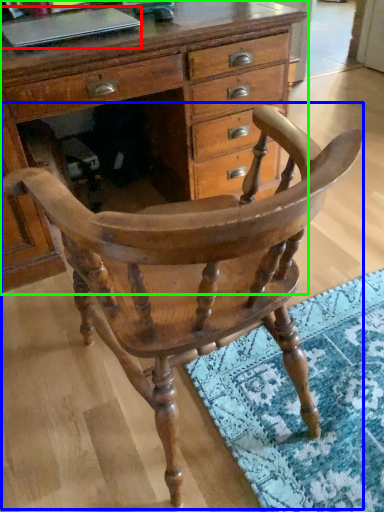
Question: Based on their relative distances, which object is farther from laptop (highlighted by a red box)? Choose from chair (highlighted by a blue box) and chest of drawers (highlighted by a green box).

Choices:
 (A) chair
 (B) chest of drawers

Answer: (A)